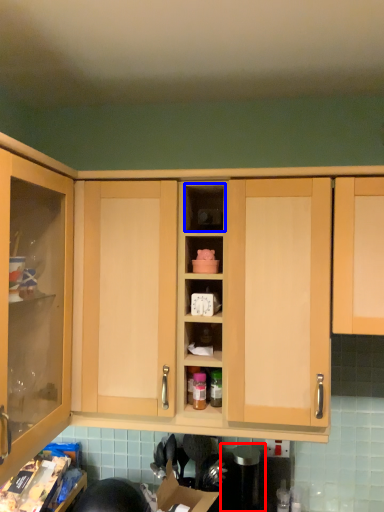
Question: Which object appears closest to the camera in this image, appliance (highlighted by a red box) or cabinet (highlighted by a blue box)?

Choices:
 (A) appliance
 (B) cabinet

Answer: (B)